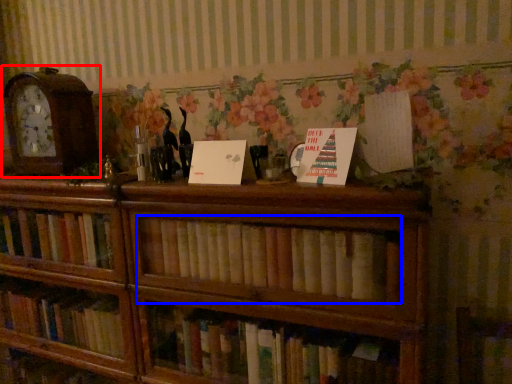
Question: Which object is closer to the camera taking this photo, alarm clock (highlighted by a red box) or book (highlighted by a blue box)?

Choices:
 (A) alarm clock
 (B) book

Answer: (B)